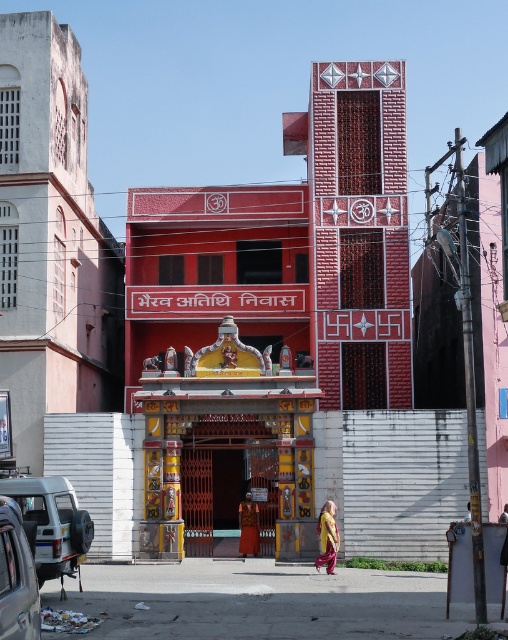
Question: Can you confirm if silver metallic van at lower left is wider than orange velvet robe at center?

Choices:
 (A) no
 (B) yes

Answer: (B)

Question: Which point is closer to the camera?

Choices:
 (A) (334, 512)
 (B) (13, 497)

Answer: (B)

Question: Estimate the real-world distances between objects in this image. Which object is closer to the metallic silver car at lower left?

Choices:
 (A) silver metallic van at lower left
 (B) yellow satin robe at center
 (C) wooden gate at center
 (D) orange velvet robe at center

Answer: (A)

Question: Can you confirm if silver metallic van at lower left is positioned to the right of yellow satin robe at center?

Choices:
 (A) no
 (B) yes

Answer: (A)

Question: Which point is closer to the camera?

Choices:
 (A) silver metallic van at lower left
 (B) metallic silver car at lower left
 (C) wooden gate at center

Answer: (B)

Question: Where is yellow satin robe at center located in relation to orange velvet robe at center in the image?

Choices:
 (A) right
 (B) left

Answer: (A)